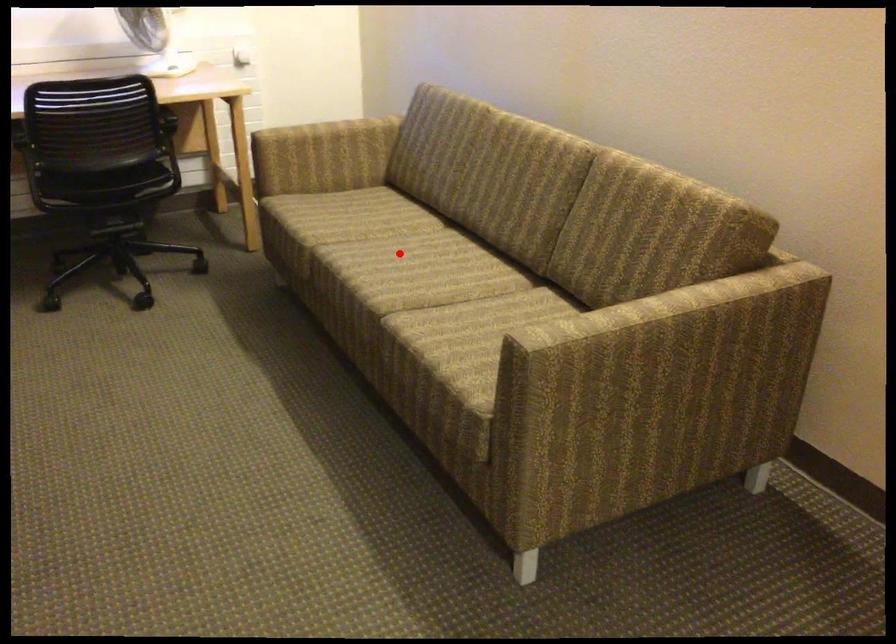
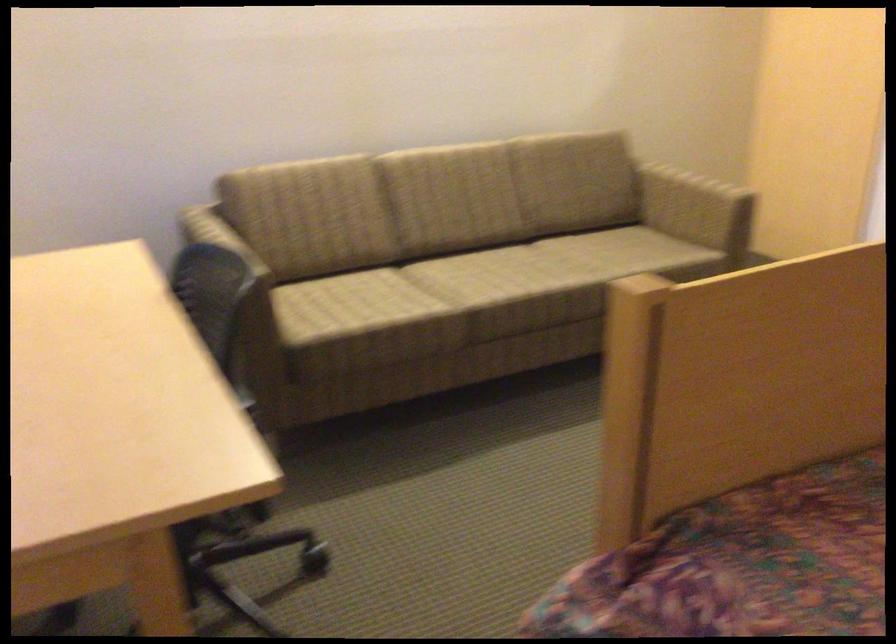
Where in the second image is the point corresponding to the highlighted location from the first image?

(470, 279)